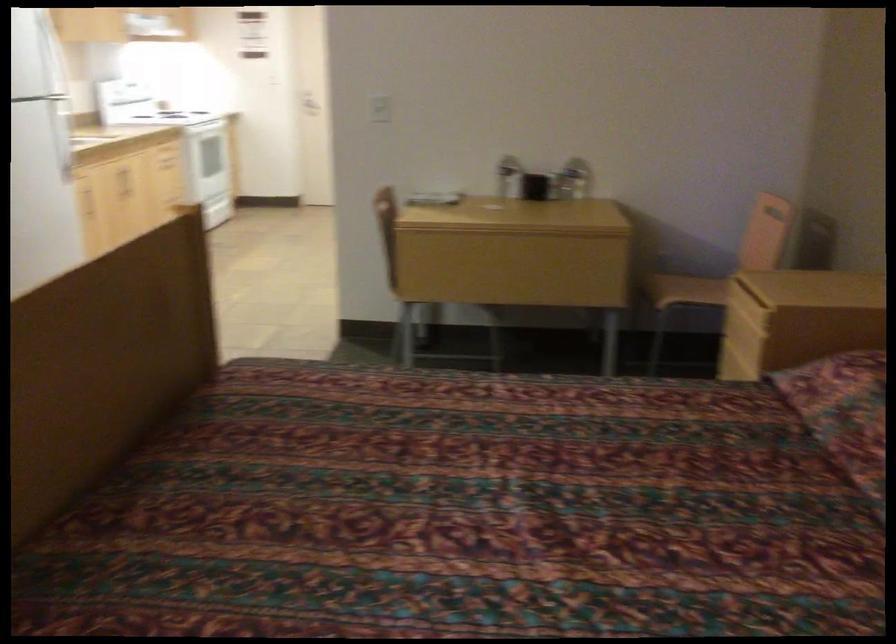
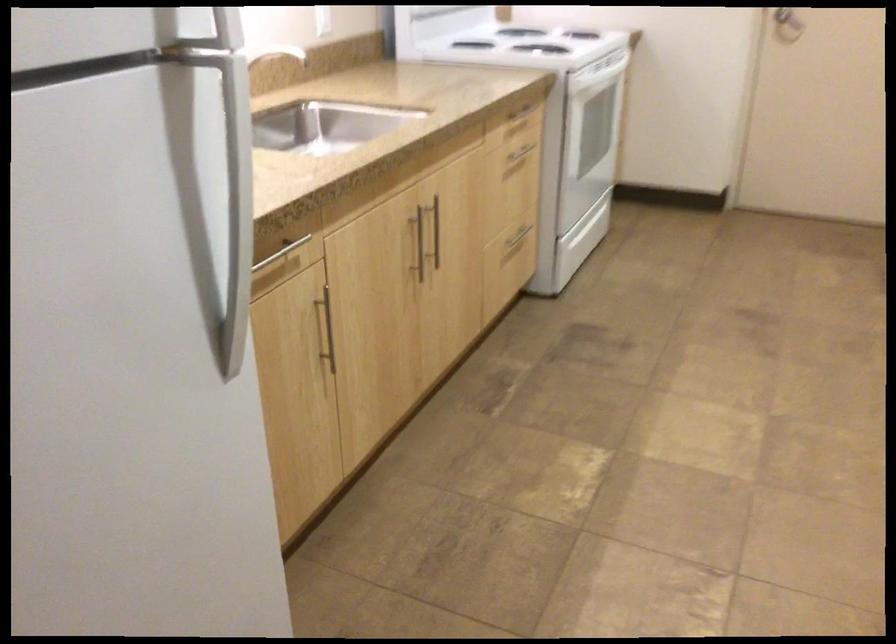
What movement of the cameraman would produce the second image?

The cameraman moved toward left, forward.